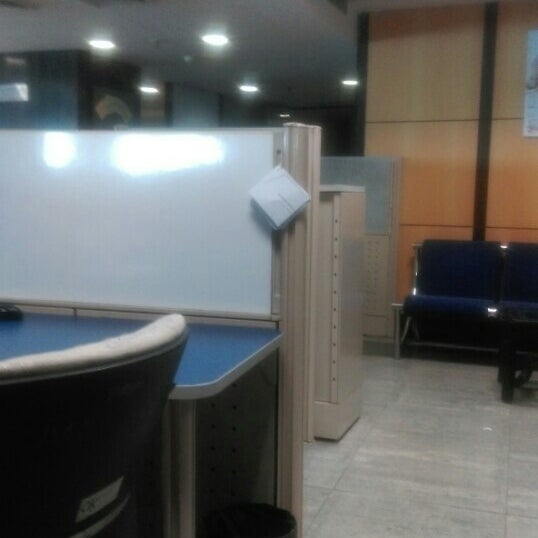
What are the coordinates of `filing cabinet` in the screenshot? It's located at (342, 317).